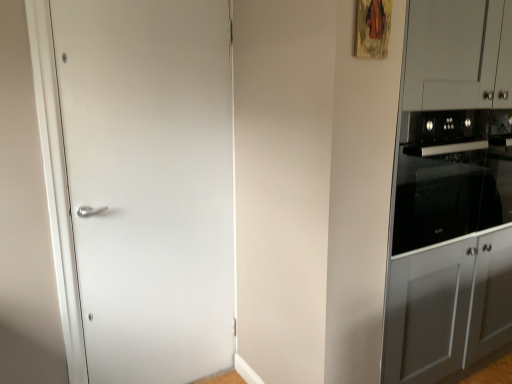
Question: Can you confirm if black glass oven at right is positioned to the left of white matte door at left?

Choices:
 (A) yes
 (B) no

Answer: (B)

Question: Is the position of black glass oven at right more distant than that of white matte door at left?

Choices:
 (A) no
 (B) yes

Answer: (B)

Question: Are black glass oven at right and white matte door at left far apart?

Choices:
 (A) no
 (B) yes

Answer: (B)

Question: From a real-world perspective, is black glass oven at right on white matte door at left?

Choices:
 (A) yes
 (B) no

Answer: (A)

Question: From a real-world perspective, is black glass oven at right beneath white matte door at left?

Choices:
 (A) no
 (B) yes

Answer: (A)

Question: Is black glass oven at right facing away from white matte door at left?

Choices:
 (A) yes
 (B) no

Answer: (B)

Question: Is satin gray cabinet at right not near white matte door at left?

Choices:
 (A) yes
 (B) no

Answer: (A)

Question: Is satin gray cabinet at right placed right next to white matte door at left?

Choices:
 (A) yes
 (B) no

Answer: (B)

Question: Is satin gray cabinet at right to the left of white matte door at left from the viewer's perspective?

Choices:
 (A) yes
 (B) no

Answer: (B)

Question: Considering the relative positions of satin gray cabinet at right and white matte door at left in the image provided, is satin gray cabinet at right in front of white matte door at left?

Choices:
 (A) no
 (B) yes

Answer: (B)

Question: Is satin gray cabinet at right not inside white matte door at left?

Choices:
 (A) yes
 (B) no

Answer: (A)

Question: Considering the relative sizes of satin gray cabinet at right and white matte door at left in the image provided, is satin gray cabinet at right thinner than white matte door at left?

Choices:
 (A) no
 (B) yes

Answer: (A)

Question: From a real-world perspective, is black glass oven at right under satin gray cabinet at right?

Choices:
 (A) no
 (B) yes

Answer: (A)